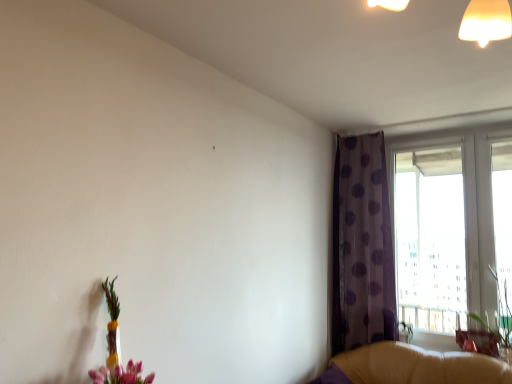
Question: Can you confirm if transparent glass window at right is positioned to the right of translucent glass vase at lower left?

Choices:
 (A) no
 (B) yes

Answer: (B)

Question: Does transparent glass window at right have a smaller size compared to translucent glass vase at lower left?

Choices:
 (A) no
 (B) yes

Answer: (A)

Question: From the image's perspective, would you say transparent glass window at right is positioned over translucent glass vase at lower left?

Choices:
 (A) yes
 (B) no

Answer: (A)

Question: Does transparent glass window at right have a greater width compared to translucent glass vase at lower left?

Choices:
 (A) no
 (B) yes

Answer: (A)

Question: Considering the relative positions of transparent glass window at right and translucent glass vase at lower left in the image provided, is transparent glass window at right to the left of translucent glass vase at lower left from the viewer's perspective?

Choices:
 (A) yes
 (B) no

Answer: (B)

Question: From the image's perspective, is transparent glass window at right below translucent glass vase at lower left?

Choices:
 (A) yes
 (B) no

Answer: (B)

Question: Is the depth of translucent glass vase at lower left less than that of leather couch at lower right?

Choices:
 (A) no
 (B) yes

Answer: (B)

Question: Is translucent glass vase at lower left wider than leather couch at lower right?

Choices:
 (A) yes
 (B) no

Answer: (B)

Question: Is translucent glass vase at lower left behind leather couch at lower right?

Choices:
 (A) yes
 (B) no

Answer: (B)

Question: Are translucent glass vase at lower left and leather couch at lower right located far from each other?

Choices:
 (A) no
 (B) yes

Answer: (B)

Question: From a real-world perspective, is translucent glass vase at lower left beneath leather couch at lower right?

Choices:
 (A) yes
 (B) no

Answer: (B)

Question: Is translucent glass vase at lower left positioned beyond the bounds of leather couch at lower right?

Choices:
 (A) no
 (B) yes

Answer: (B)

Question: Considering the relative positions of matte brown swivel chair at lower right and transparent glass window at right in the image provided, is matte brown swivel chair at lower right to the right of transparent glass window at right from the viewer's perspective?

Choices:
 (A) yes
 (B) no

Answer: (A)